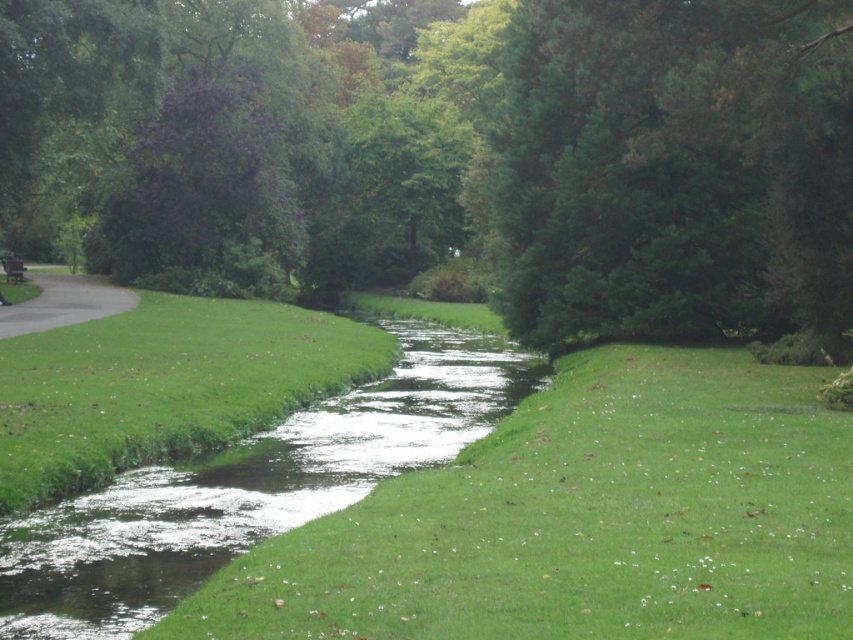
Is clear water stream at center to the right of wooden park bench at left from the viewer's perspective?

Indeed, clear water stream at center is positioned on the right side of wooden park bench at left.

Can you confirm if clear water stream at center is positioned to the left of wooden park bench at left?

In fact, clear water stream at center is to the right of wooden park bench at left.

Which is in front, point (340, 493) or point (10, 272)?

Point (340, 493) is in front.

I want to click on clear water stream at center, so click(248, 488).

Is green grassy at center positioned behind wooden park bench at left?

That is False.

Is point (248, 579) more distant than point (7, 262)?

No, (248, 579) is closer to viewer.

What do you see at coordinates (582, 522) in the screenshot? I see `green grassy at center` at bounding box center [582, 522].

I want to click on green grassy at center, so click(x=582, y=522).

Locate an element on the screen. The width and height of the screenshot is (853, 640). green grassy at center is located at coordinates (582, 522).

Is green grassy at center above clear water stream at center?

No.

What do you see at coordinates (582, 522) in the screenshot? The height and width of the screenshot is (640, 853). I see `green grassy at center` at bounding box center [582, 522].

At what (x,y) coordinates should I click in order to perform the action: click on green grassy at center. Please return your answer as a coordinate pair (x, y). Looking at the image, I should click on (582, 522).